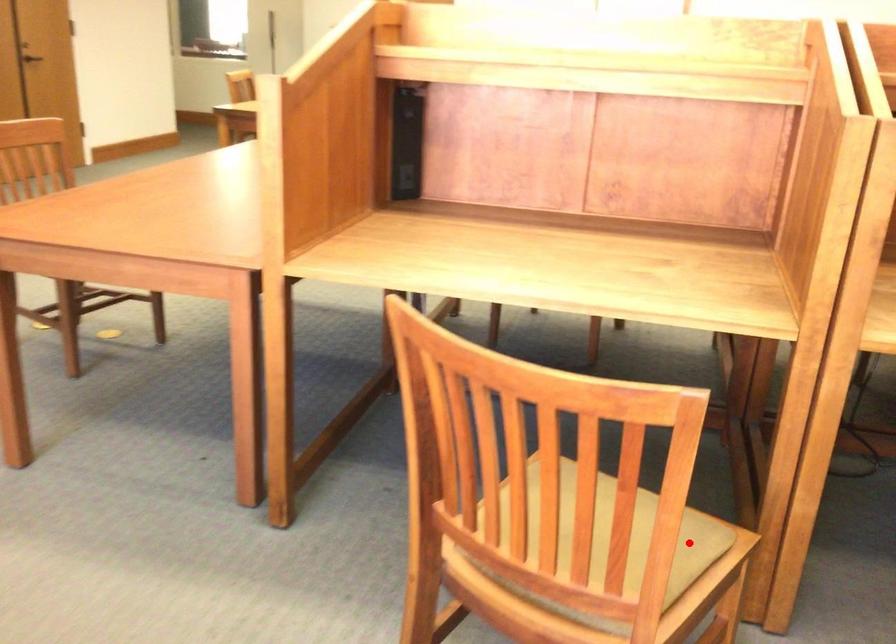
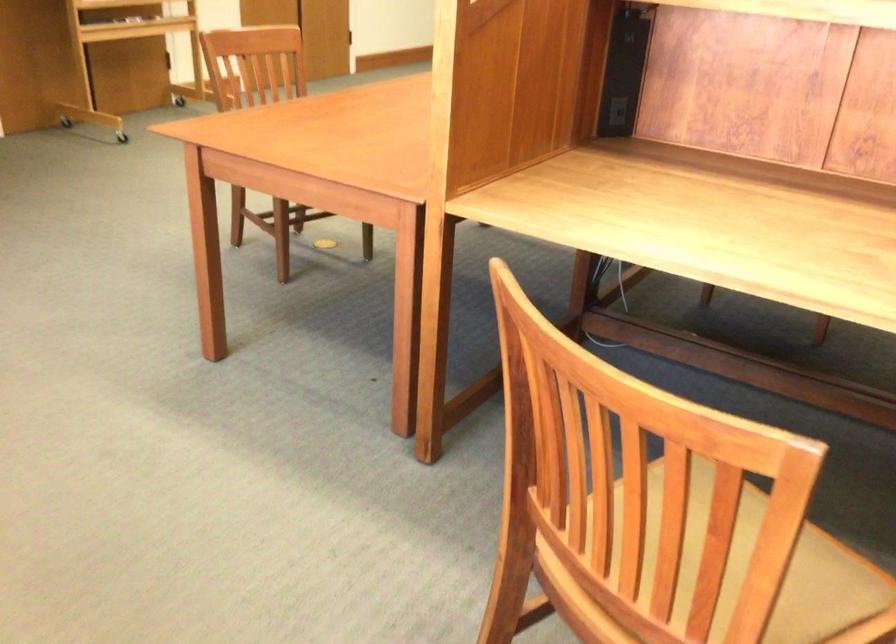
The point at the highlighted location is marked in the first image. Where is the corresponding point in the second image?

(833, 594)